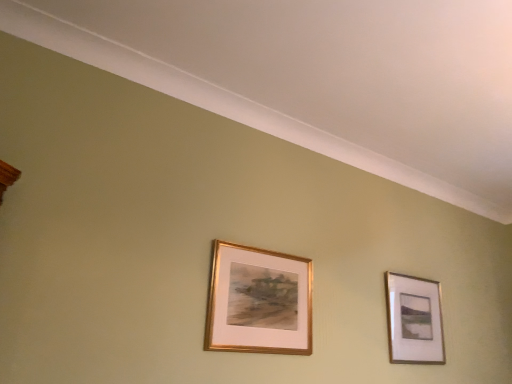
Describe the element at coordinates (259, 301) in the screenshot. The height and width of the screenshot is (384, 512). I see `gold metallic frame at center, acting as the first picture frame starting from the left` at that location.

At what (x,y) coordinates should I click in order to perform the action: click on gold metallic frame at center, acting as the first picture frame starting from the left. Please return your answer as a coordinate pair (x, y). Looking at the image, I should click on pos(259,301).

The image size is (512, 384). What do you see at coordinates (414, 320) in the screenshot?
I see `gold metallic picture frame at upper right, the 1th picture frame positioned from the right` at bounding box center [414, 320].

Image resolution: width=512 pixels, height=384 pixels. Find the location of `gold metallic picture frame at upper right, arranged as the second picture frame when viewed from the front`. gold metallic picture frame at upper right, arranged as the second picture frame when viewed from the front is located at coordinates (414, 320).

Locate an element on the screen. This screenshot has height=384, width=512. gold metallic frame at center, placed as the first picture frame when sorted from front to back is located at coordinates (259, 301).

Which is more to the right, gold metallic picture frame at upper right, which ranks as the 1th picture frame in back-to-front order, or gold metallic frame at center, acting as the first picture frame starting from the left?

Positioned to the right is gold metallic picture frame at upper right, which ranks as the 1th picture frame in back-to-front order.

Which object is closer to the camera taking this photo, gold metallic picture frame at upper right, the 1th picture frame positioned from the right, or gold metallic frame at center, placed as the first picture frame when sorted from front to back?

gold metallic frame at center, placed as the first picture frame when sorted from front to back, is in front.

Which is further, (398,315) or (309,285)?

The point (398,315) is behind.

From the image's perspective, is gold metallic picture frame at upper right, which ranks as the 1th picture frame in back-to-front order, positioned above or below gold metallic frame at center, placed as the first picture frame when sorted from front to back?

From the image's perspective, gold metallic picture frame at upper right, which ranks as the 1th picture frame in back-to-front order, appears below gold metallic frame at center, placed as the first picture frame when sorted from front to back.

From a real-world perspective, who is located lower, gold metallic picture frame at upper right, arranged as the second picture frame when viewed from the front, or gold metallic frame at center, arranged as the second picture frame when viewed from the back?

From a 3D spatial view, gold metallic frame at center, arranged as the second picture frame when viewed from the back, is below.

In terms of width, does gold metallic picture frame at upper right, arranged as the second picture frame when viewed from the front, look wider or thinner when compared to gold metallic frame at center, acting as the first picture frame starting from the left?

Clearly, gold metallic picture frame at upper right, arranged as the second picture frame when viewed from the front, has more width compared to gold metallic frame at center, acting as the first picture frame starting from the left.

Is gold metallic picture frame at upper right, which ranks as the 1th picture frame in back-to-front order, taller than gold metallic frame at center, acting as the first picture frame starting from the left?

Yes, gold metallic picture frame at upper right, which ranks as the 1th picture frame in back-to-front order, is taller than gold metallic frame at center, acting as the first picture frame starting from the left.

Who is bigger, gold metallic picture frame at upper right, arranged as the 2th picture frame when viewed from the left, or gold metallic frame at center, acting as the first picture frame starting from the left?

gold metallic picture frame at upper right, arranged as the 2th picture frame when viewed from the left.

Is gold metallic picture frame at upper right, arranged as the 2th picture frame when viewed from the left, inside the boundaries of gold metallic frame at center, marked as the second picture frame in a right-to-left arrangement, or outside?

gold metallic picture frame at upper right, arranged as the 2th picture frame when viewed from the left, is located beyond the bounds of gold metallic frame at center, marked as the second picture frame in a right-to-left arrangement.

Is gold metallic picture frame at upper right, the 1th picture frame positioned from the right, touching gold metallic frame at center, marked as the second picture frame in a right-to-left arrangement?

No, gold metallic picture frame at upper right, the 1th picture frame positioned from the right, is not with gold metallic frame at center, marked as the second picture frame in a right-to-left arrangement.

Is gold metallic picture frame at upper right, arranged as the 2th picture frame when viewed from the left, oriented away from gold metallic frame at center, marked as the second picture frame in a right-to-left arrangement?

gold metallic picture frame at upper right, arranged as the 2th picture frame when viewed from the left, does not have its back to gold metallic frame at center, marked as the second picture frame in a right-to-left arrangement.

Measure the distance from gold metallic picture frame at upper right, the 1th picture frame positioned from the right, to gold metallic frame at center, acting as the first picture frame starting from the left.

32.62 inches.

Where is `picture frame above the gold metallic frame at center, placed as the first picture frame when sorted from front to back (from a real-world perspective)`? picture frame above the gold metallic frame at center, placed as the first picture frame when sorted from front to back (from a real-world perspective) is located at coordinates (414, 320).

Considering the positions of objects gold metallic frame at center, marked as the second picture frame in a right-to-left arrangement, and gold metallic picture frame at upper right, arranged as the 2th picture frame when viewed from the left, in the image provided, who is more to the right, gold metallic frame at center, marked as the second picture frame in a right-to-left arrangement, or gold metallic picture frame at upper right, arranged as the 2th picture frame when viewed from the left,?

gold metallic picture frame at upper right, arranged as the 2th picture frame when viewed from the left.

Is gold metallic frame at center, acting as the first picture frame starting from the left, in front of or behind gold metallic picture frame at upper right, arranged as the 2th picture frame when viewed from the left, in the image?

In the image, gold metallic frame at center, acting as the first picture frame starting from the left, appears in front of gold metallic picture frame at upper right, arranged as the 2th picture frame when viewed from the left.

Does point (231, 308) come closer to viewer compared to point (443, 343)?

Yes.

Based on the photo, from the image's perspective, relative to gold metallic picture frame at upper right, arranged as the second picture frame when viewed from the front, is gold metallic frame at center, arranged as the second picture frame when viewed from the back, above or below?

gold metallic frame at center, arranged as the second picture frame when viewed from the back, is situated higher than gold metallic picture frame at upper right, arranged as the second picture frame when viewed from the front, in the image.

From a real-world perspective, is gold metallic frame at center, arranged as the second picture frame when viewed from the back, positioned over gold metallic picture frame at upper right, arranged as the 2th picture frame when viewed from the left, based on gravity?

Incorrect, from a real-world perspective, gold metallic frame at center, arranged as the second picture frame when viewed from the back, is lower than gold metallic picture frame at upper right, arranged as the 2th picture frame when viewed from the left.

In the scene shown: Between gold metallic frame at center, marked as the second picture frame in a right-to-left arrangement, and gold metallic picture frame at upper right, which ranks as the 1th picture frame in back-to-front order, which one has smaller width?

gold metallic frame at center, marked as the second picture frame in a right-to-left arrangement, is thinner.

Between gold metallic frame at center, arranged as the second picture frame when viewed from the back, and gold metallic picture frame at upper right, arranged as the 2th picture frame when viewed from the left, which one has more height?

gold metallic picture frame at upper right, arranged as the 2th picture frame when viewed from the left.

Considering the sizes of gold metallic frame at center, arranged as the second picture frame when viewed from the back, and gold metallic picture frame at upper right, arranged as the 2th picture frame when viewed from the left, in the image, is gold metallic frame at center, arranged as the second picture frame when viewed from the back, bigger or smaller than gold metallic picture frame at upper right, arranged as the 2th picture frame when viewed from the left,?

Clearly, gold metallic frame at center, arranged as the second picture frame when viewed from the back, is smaller in size than gold metallic picture frame at upper right, arranged as the 2th picture frame when viewed from the left.

Is gold metallic frame at center, arranged as the second picture frame when viewed from the back, spatially inside gold metallic picture frame at upper right, the 1th picture frame positioned from the right, or outside of it?

gold metallic frame at center, arranged as the second picture frame when viewed from the back, is not enclosed by gold metallic picture frame at upper right, the 1th picture frame positioned from the right.

Is gold metallic frame at center, arranged as the second picture frame when viewed from the back, with gold metallic picture frame at upper right, arranged as the second picture frame when viewed from the front?

There is a gap between gold metallic frame at center, arranged as the second picture frame when viewed from the back, and gold metallic picture frame at upper right, arranged as the second picture frame when viewed from the front.

Could you tell me if gold metallic frame at center, arranged as the second picture frame when viewed from the back, is facing gold metallic picture frame at upper right, arranged as the 2th picture frame when viewed from the left?

No, gold metallic frame at center, arranged as the second picture frame when viewed from the back, is not turned towards gold metallic picture frame at upper right, arranged as the 2th picture frame when viewed from the left.

How far apart are gold metallic frame at center, marked as the second picture frame in a right-to-left arrangement, and gold metallic picture frame at upper right, arranged as the second picture frame when viewed from the front?

gold metallic frame at center, marked as the second picture frame in a right-to-left arrangement, is 32.62 inches away from gold metallic picture frame at upper right, arranged as the second picture frame when viewed from the front.

In order to click on picture frame located above the gold metallic frame at center, arranged as the second picture frame when viewed from the back (from a real-world perspective) in this screenshot , I will do `click(414, 320)`.

Identify the location of picture frame above the gold metallic picture frame at upper right, arranged as the second picture frame when viewed from the front (from the image's perspective). The image size is (512, 384). (259, 301).

Image resolution: width=512 pixels, height=384 pixels. Identify the location of picture frame lying below the gold metallic frame at center, acting as the first picture frame starting from the left (from the image's perspective). (414, 320).